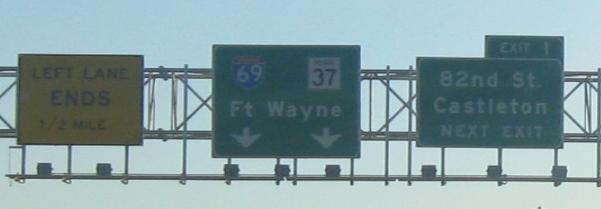
This screenshot has width=601, height=209. Identify the location of lights. (492, 177), (553, 173), (435, 170), (330, 170), (279, 169), (231, 168), (99, 175), (43, 169).